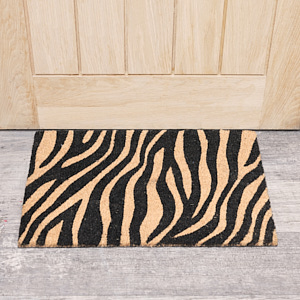
The width and height of the screenshot is (300, 300). Find the location of `rug`. rug is located at coordinates (142, 216).